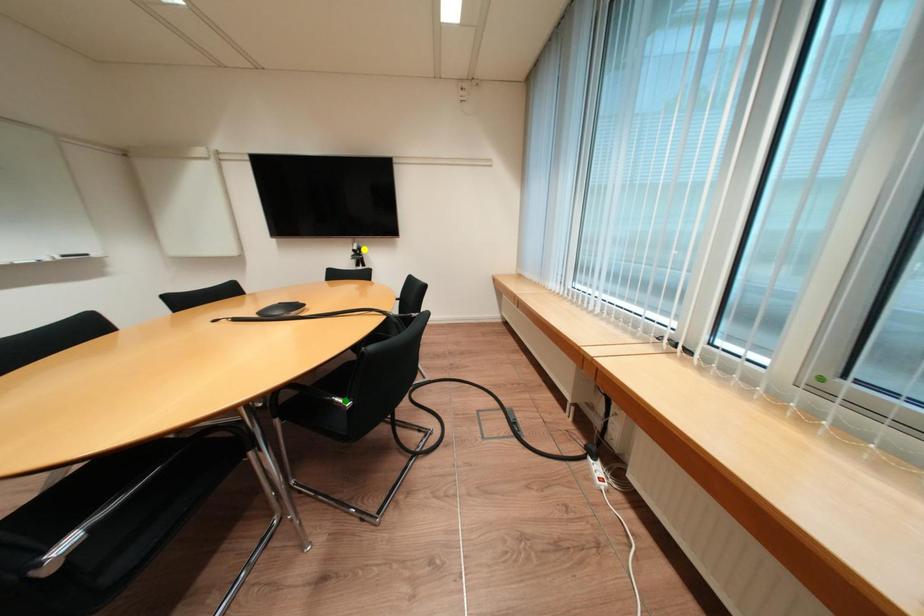
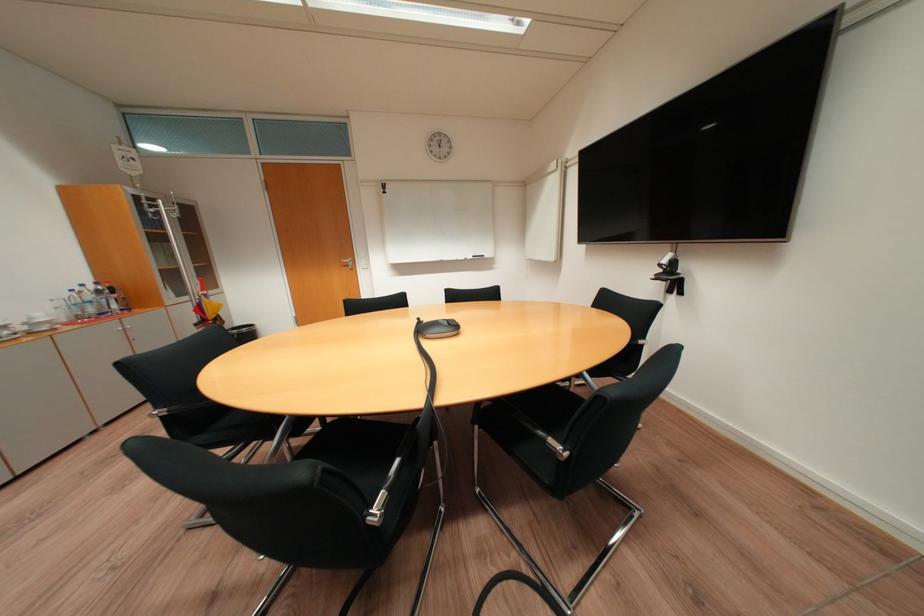
I am providing you with two images of the same scene from different viewpoints. Three points are marked in image1. Which point corresponds to a part or object that is occluded in image2?In image1, three points are marked. Which of them correspond to a part or object that is occluded in image2?Among the three points shown in image1, which one corresponds to a part or object that is no longer visible due to occlusion in image2?

blue point, green point